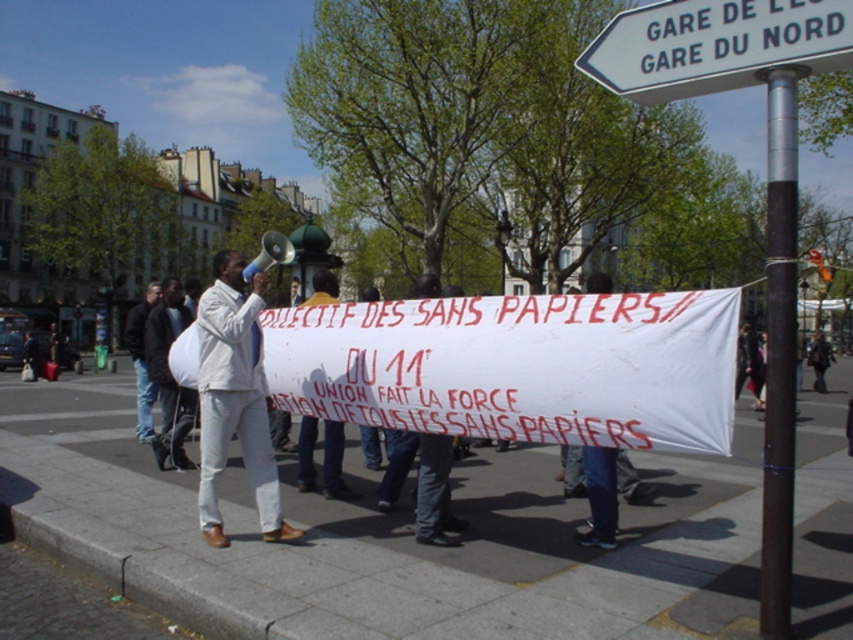
Question: Which of these objects is positioned farthest from the dark brown polished metal pole at upper right?

Choices:
 (A) light beige suit at center
 (B) white plastic sign at upper center

Answer: (A)

Question: Is light beige suit at center below white fabric bag at center?

Choices:
 (A) yes
 (B) no

Answer: (A)

Question: Which point is closer to the camera taking this photo?

Choices:
 (A) (782, 150)
 (B) (160, 456)

Answer: (A)

Question: In this image, where is white fabric bag at center located relative to light beige jacket at center?

Choices:
 (A) below
 (B) above

Answer: (A)

Question: Which point is farther from the camera taking this photo?

Choices:
 (A) (167, 429)
 (B) (146, 388)
 (C) (244, 316)

Answer: (B)

Question: Is light beige suit at center above white fabric bag at center?

Choices:
 (A) yes
 (B) no

Answer: (B)